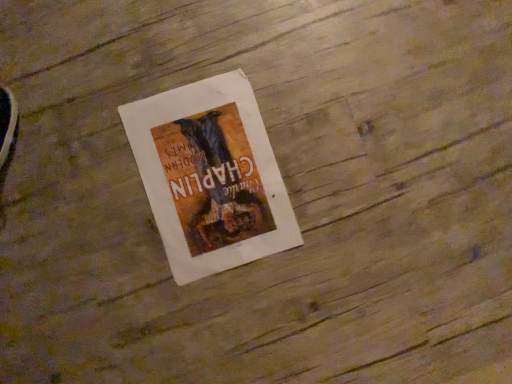
What is the approximate height of white paper poster at center?

white paper poster at center is 0.70 inches in height.

I want to click on white paper poster at center, so click(x=210, y=176).

What do you see at coordinates (210, 176) in the screenshot? The image size is (512, 384). I see `white paper poster at center` at bounding box center [210, 176].

You are a GUI agent. You are given a task and a screenshot of the screen. Output one action in this format:
    pyautogui.click(x=<x>, y=<y>)
    Task: Click on the white paper poster at center
    Image resolution: width=512 pixels, height=384 pixels.
    Given the screenshot: What is the action you would take?
    coord(210,176)